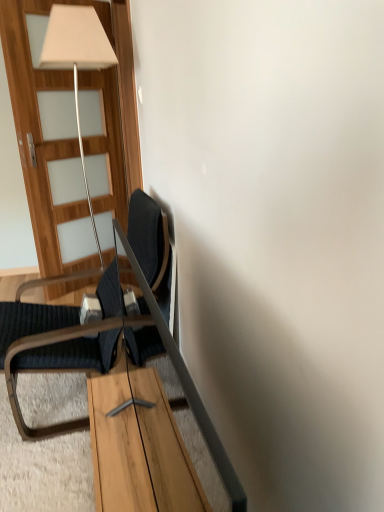
Question: From the image's perspective, would you say wooden table at center is positioned over dark blue fabric chair at left?

Choices:
 (A) yes
 (B) no

Answer: (B)

Question: From a real-world perspective, is wooden table at center below dark blue fabric chair at left?

Choices:
 (A) yes
 (B) no

Answer: (A)

Question: From the image's perspective, does wooden table at center appear lower than dark blue fabric chair at left?

Choices:
 (A) no
 (B) yes

Answer: (B)

Question: Is wooden table at center turned away from dark blue fabric chair at left?

Choices:
 (A) no
 (B) yes

Answer: (A)

Question: Considering the relative positions of wooden table at center and dark blue fabric chair at left in the image provided, is wooden table at center to the right of dark blue fabric chair at left from the viewer's perspective?

Choices:
 (A) yes
 (B) no

Answer: (A)

Question: Is wooden table at center behind dark blue fabric chair at left?

Choices:
 (A) yes
 (B) no

Answer: (B)

Question: Is wooden door at left located outside dark blue fabric chair at left?

Choices:
 (A) no
 (B) yes

Answer: (B)

Question: Can you confirm if wooden door at left is thinner than dark blue fabric chair at left?

Choices:
 (A) no
 (B) yes

Answer: (B)

Question: Is wooden door at left bigger than dark blue fabric chair at left?

Choices:
 (A) no
 (B) yes

Answer: (A)

Question: Is the position of wooden door at left less distant than that of dark blue fabric chair at left?

Choices:
 (A) no
 (B) yes

Answer: (A)

Question: Can you confirm if wooden door at left is taller than dark blue fabric chair at left?

Choices:
 (A) no
 (B) yes

Answer: (B)

Question: From a real-world perspective, is wooden door at left positioned under dark blue fabric chair at left based on gravity?

Choices:
 (A) no
 (B) yes

Answer: (A)

Question: Is dark blue fabric chair at left next to wooden door at left and touching it?

Choices:
 (A) yes
 (B) no

Answer: (B)